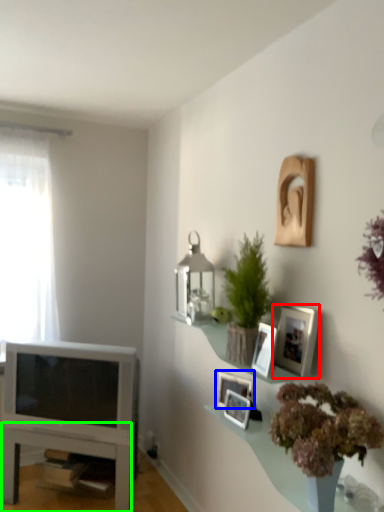
Question: Which object is the farthest from picture frame (highlighted by a red box)? Choose among these: picture frame (highlighted by a blue box) or table (highlighted by a green box).

Choices:
 (A) picture frame
 (B) table

Answer: (B)